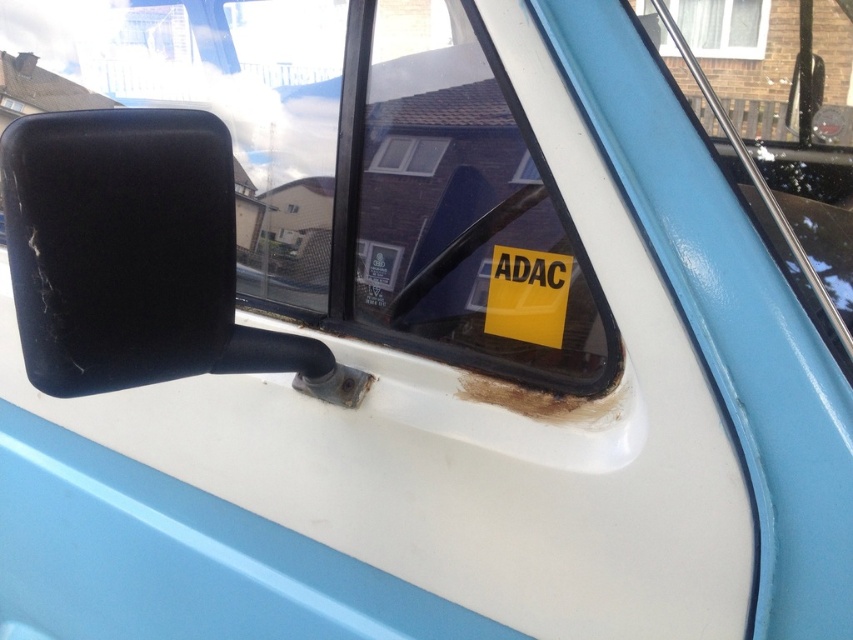
Can you confirm if transparent glass windshield at center is wider than yellow paper at center?

Yes.

Between transparent glass windshield at center and yellow paper at center, which one has less height?

yellow paper at center is shorter.

Is point (360, 202) positioned after point (521, 177)?

Yes, it is behind point (521, 177).

You are a GUI agent. You are given a task and a screenshot of the screen. Output one action in this format:
    pyautogui.click(x=<x>, y=<y>)
    Task: Click on the transparent glass windshield at center
    This screenshot has width=853, height=640.
    Given the screenshot: What is the action you would take?
    tap(303, 189)

Is point (62, 196) farther from viewer compared to point (535, 173)?

No, it is not.

From the picture: Between matte black mirror at left and yellow paper at center, which one is positioned lower?

matte black mirror at left is lower down.

Does point (209, 138) come closer to viewer compared to point (514, 173)?

Yes, point (209, 138) is in front of point (514, 173).

Find the location of a particular element. matte black mirror at left is located at coordinates (135, 257).

Who is lower down, matte black mirror at left or transparent glass window at upper center?

Positioned lower is matte black mirror at left.

Does matte black mirror at left come in front of transparent glass window at upper center?

That is True.

Is point (120, 188) positioned in front of point (381, 172)?

Yes, point (120, 188) is closer to viewer.

You are a GUI agent. You are given a task and a screenshot of the screen. Output one action in this format:
    pyautogui.click(x=<x>, y=<y>)
    Task: Click on the matte black mirror at left
    The height and width of the screenshot is (640, 853).
    Given the screenshot: What is the action you would take?
    tap(135, 257)